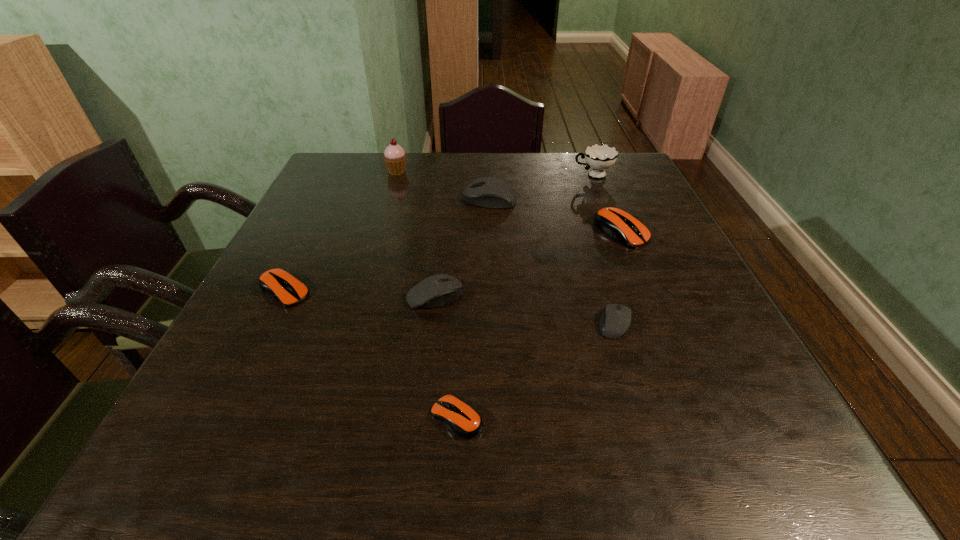
Find the location of a particular element. The image size is (960, 540). the seventh object from right to left is located at coordinates (394, 157).

Find the location of a particular element. The image size is (960, 540). the tallest object is located at coordinates (394, 157).

The height and width of the screenshot is (540, 960). I want to click on the second tallest object, so click(x=599, y=157).

This screenshot has width=960, height=540. What are the coordinates of `cup` in the screenshot? It's located at (599, 157).

Locate an element on the screen. The width and height of the screenshot is (960, 540). the tallest computer mouse is located at coordinates (489, 192).

The height and width of the screenshot is (540, 960). I want to click on the farthest computer mouse, so click(x=489, y=192).

You are a GUI agent. You are given a task and a screenshot of the screen. Output one action in this format:
    pyautogui.click(x=<x>, y=<y>)
    Task: Click on the rightmost orange computer mouse
    This screenshot has width=960, height=540.
    Given the screenshot: What is the action you would take?
    pyautogui.click(x=615, y=222)

Identify the location of the farthest orange computer mouse. (615, 222).

Where is `the second smallest black computer equipment`? The width and height of the screenshot is (960, 540). the second smallest black computer equipment is located at coordinates (440, 289).

Locate an element on the screen. This screenshot has height=540, width=960. the second farthest orange computer mouse is located at coordinates (279, 284).